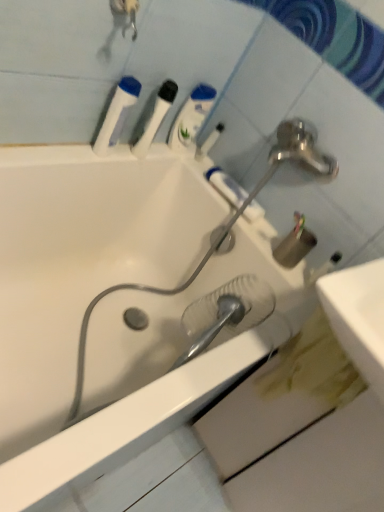
Image resolution: width=384 pixels, height=512 pixels. Find the location of `free space to the left of white matte toothpaste at upper center`. free space to the left of white matte toothpaste at upper center is located at coordinates (195, 164).